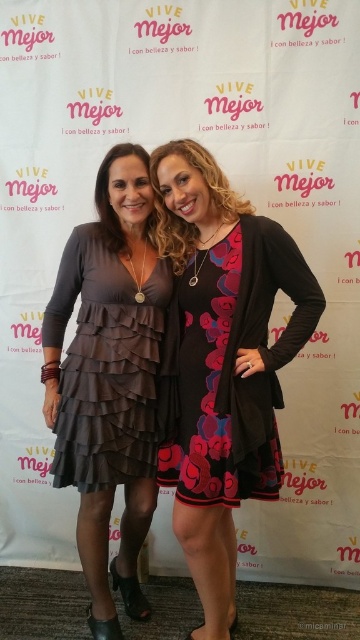
Question: Does matte gray dress at center have a larger size compared to floral-patterned dress at center?

Choices:
 (A) no
 (B) yes

Answer: (B)

Question: Can you confirm if matte gray dress at center is thinner than floral-patterned dress at center?

Choices:
 (A) yes
 (B) no

Answer: (B)

Question: Does floral dress at center appear over matte gray dress at center?

Choices:
 (A) no
 (B) yes

Answer: (A)

Question: Which of the following is the closest to the observer?

Choices:
 (A) floral dress at center
 (B) matte gray dress at center
 (C) floral-patterned dress at center

Answer: (C)

Question: Which of the following is the closest to the observer?

Choices:
 (A) matte gray dress at center
 (B) floral dress at center

Answer: (B)

Question: Which is nearer to the matte gray dress at center?

Choices:
 (A) floral-patterned dress at center
 (B) floral dress at center

Answer: (A)